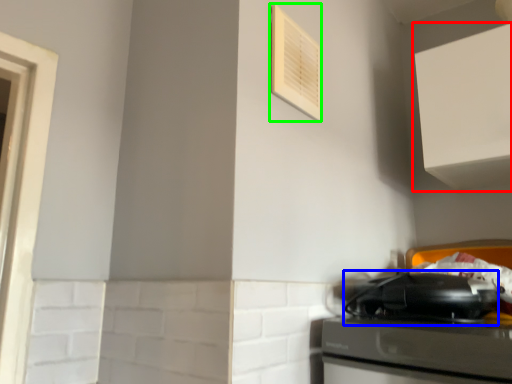
Question: Estimate the real-world distances between objects in this image. Which object is farther from cabinetry (highlighted by a red box), appliance (highlighted by a blue box) or air conditioner (highlighted by a green box)?

Choices:
 (A) appliance
 (B) air conditioner

Answer: (B)